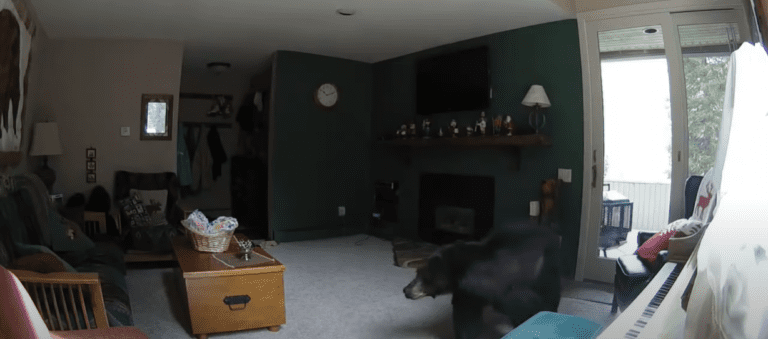
Locate an element on the screen. The height and width of the screenshot is (339, 768). tv is located at coordinates (454, 80).